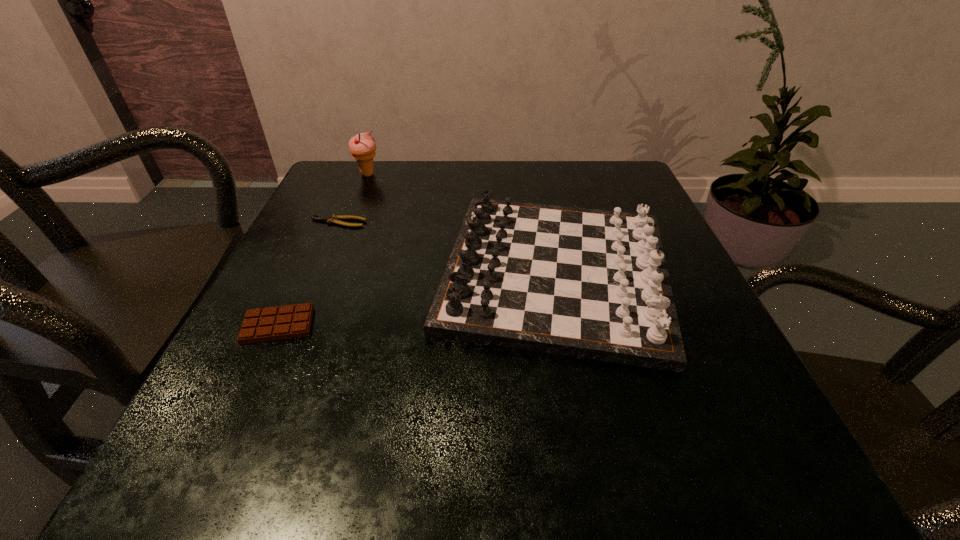
What are the coordinates of `the tallest object` in the screenshot? It's located at (362, 146).

I want to click on the farthest object, so click(x=362, y=146).

Where is `the rightmost object`? the rightmost object is located at coordinates (586, 283).

Find the location of a particular element. The height and width of the screenshot is (540, 960). the second tallest object is located at coordinates [x=586, y=283].

Identify the location of candy bar. The image size is (960, 540). (290, 321).

Locate an element on the screen. pliers is located at coordinates (334, 218).

Where is `vacant space located on the front of the tallest object`? The width and height of the screenshot is (960, 540). vacant space located on the front of the tallest object is located at coordinates (326, 278).

Identify the location of free space located 0.200m on the back of the chessboard. This screenshot has height=540, width=960. (534, 164).

What are the coordinates of `vacant space positioned 0.080m on the back of the second shortest object` in the screenshot? It's located at (301, 276).

Locate an element on the screen. vacant space located on the right of the shortest object is located at coordinates (453, 222).